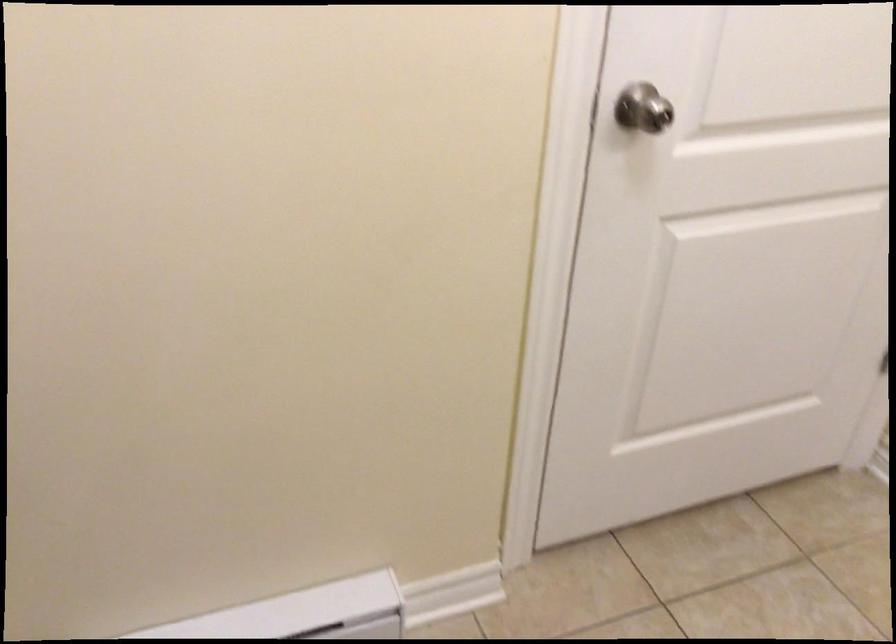
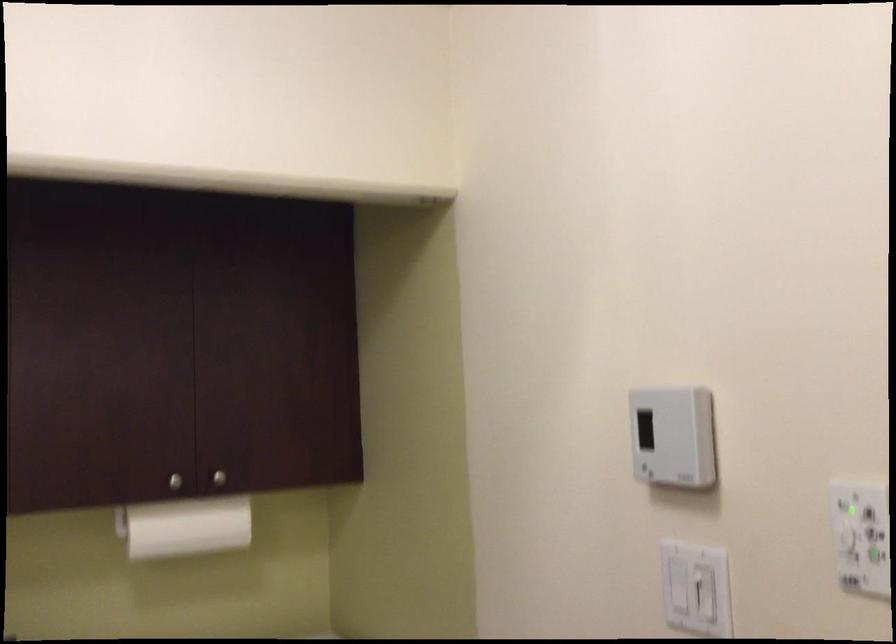
Question: The camera is either moving clockwise (left) or counter-clockwise (right) around the object. The first image is from the beginning of the video and the second image is from the end. Is the camera moving left or right when shooting the video?

Choices:
 (A) Left
 (B) Right

Answer: (B)